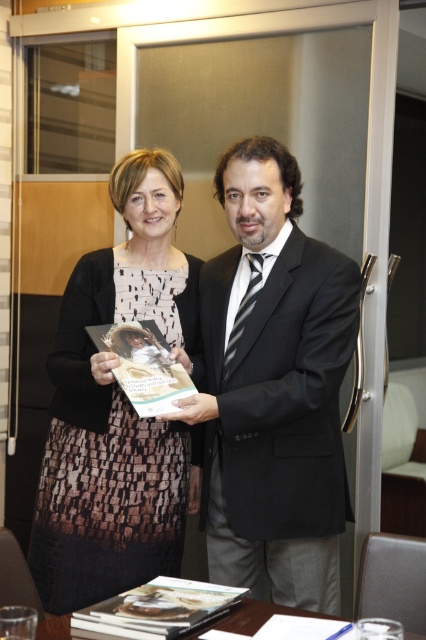
Is black satin suit at center closer to camera compared to printed fabric dress at center?

That is True.

Which of these two, black satin suit at center or printed fabric dress at center, stands shorter?

black satin suit at center

This screenshot has width=426, height=640. Find the location of `black satin suit at center`. black satin suit at center is located at coordinates (273, 388).

Which is more to the right, printed fabric dress at center or wooden table at lower center?

Positioned to the right is wooden table at lower center.

Find the location of a particular element. The image size is (426, 640). printed fabric dress at center is located at coordinates (118, 408).

Is point (321, 387) positioned after point (66, 628)?

Yes.

Does black satin suit at center have a lesser width compared to wooden table at lower center?

Yes.

Is point (241, 474) less distant than point (65, 614)?

That is False.

The height and width of the screenshot is (640, 426). I want to click on black satin suit at center, so click(273, 388).